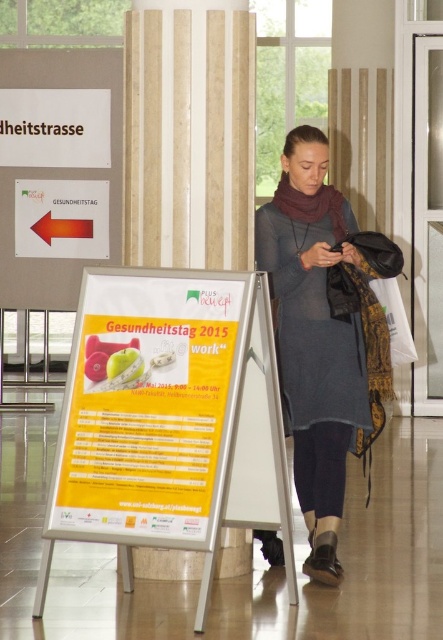
Between matte gray dress at center and orange glossy arrow at left, which one appears on the right side from the viewer's perspective?

matte gray dress at center is more to the right.

Which is in front, point (260, 236) or point (59, 204)?

Point (260, 236) is in front.

Where is `matte gray dress at center`? This screenshot has width=443, height=640. matte gray dress at center is located at coordinates (317, 337).

Is yellow paperboard at center below matte gray dress at center?

Yes.

Is yellow paperboard at center to the right of matte gray dress at center from the viewer's perspective?

Incorrect, yellow paperboard at center is not on the right side of matte gray dress at center.

Does point (65, 481) come closer to viewer compared to point (342, 253)?

Yes.

Where is `yellow paperboard at center`? The image size is (443, 640). yellow paperboard at center is located at coordinates (168, 419).

In order to click on yellow paperboard at center in this screenshot , I will do [168, 419].

The image size is (443, 640). I want to click on yellow paperboard at center, so click(168, 419).